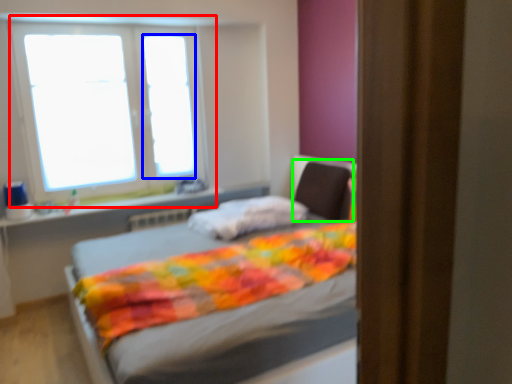
Question: Estimate the real-world distances between objects in this image. Which object is farther from window (highlighted by a red box), window screen (highlighted by a blue box) or swivel chair (highlighted by a green box)?

Choices:
 (A) window screen
 (B) swivel chair

Answer: (B)